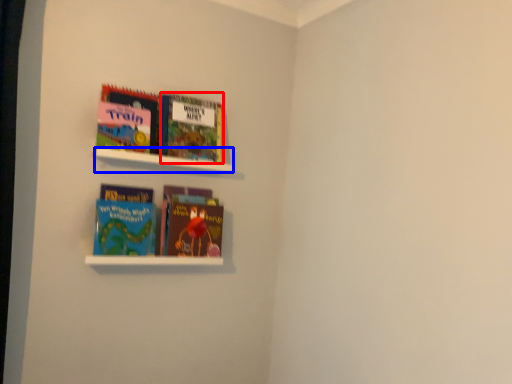
Question: Among these objects, which one is farthest to the camera, book (highlighted by a red box) or cabinet (highlighted by a blue box)?

Choices:
 (A) book
 (B) cabinet

Answer: (A)